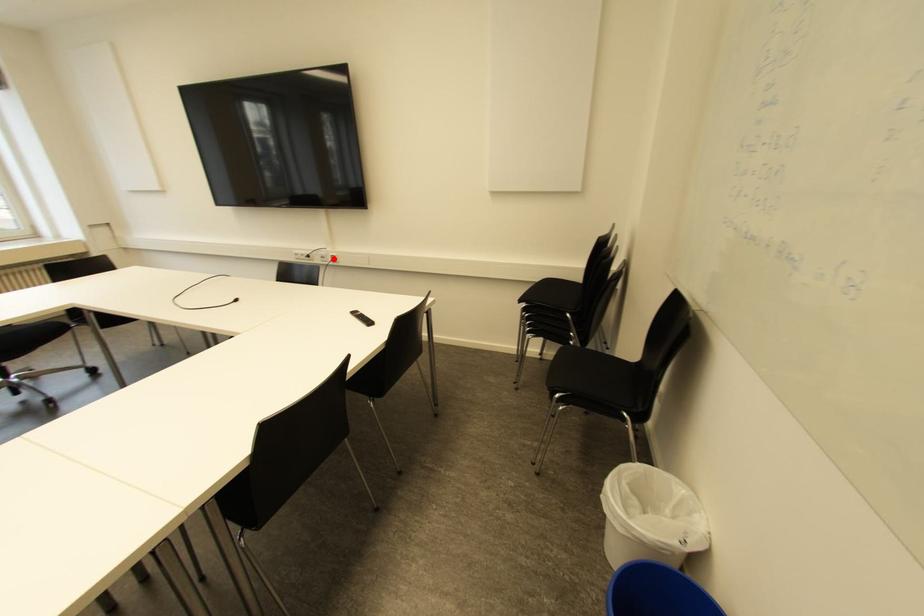
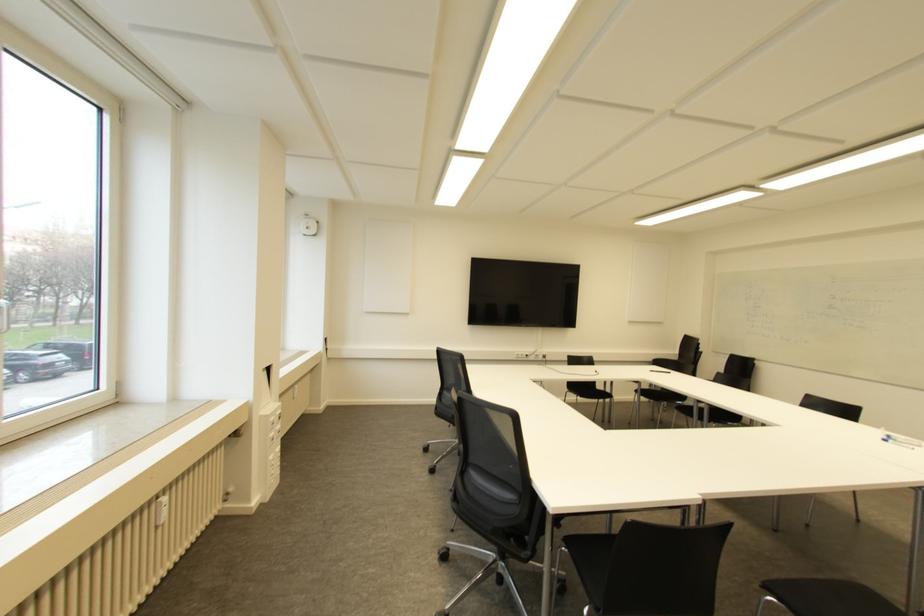
Question: I am providing you with two images of the same scene from different viewpoints. In image1, a red point is highlighted. Considering the same 3D point in image2, which of the following is correct?

Choices:
 (A) It is closer
 (B) It is farther

Answer: (B)